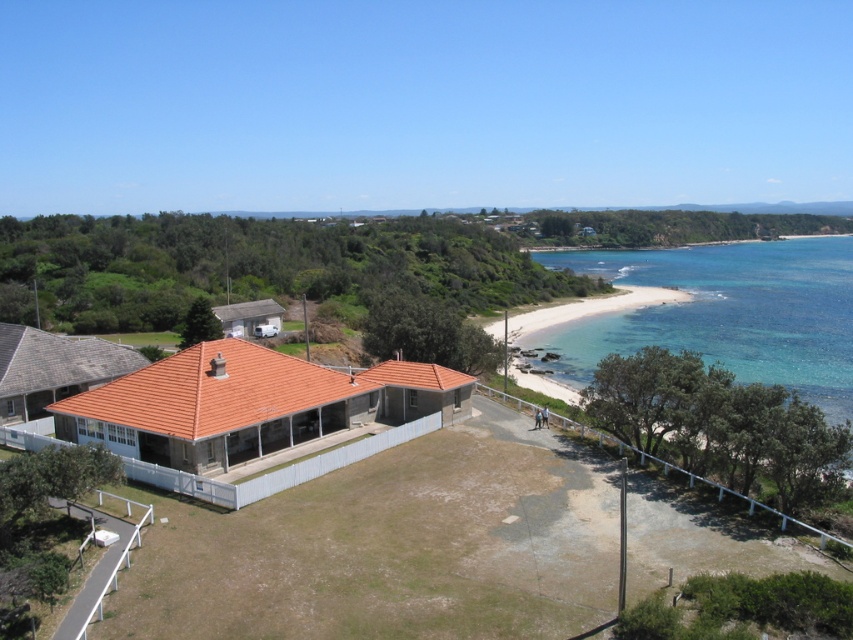
Question: Which point is closer to the camera taking this photo?

Choices:
 (A) (715, 301)
 (B) (3, 428)

Answer: (B)

Question: Which object is farther from the camera taking this photo?

Choices:
 (A) terracotta tiled house at center
 (B) clear blue water at beach right

Answer: (A)

Question: Can you confirm if terracotta tiled house at center is wider than clear blue water at beach right?

Choices:
 (A) yes
 (B) no

Answer: (B)

Question: Among these points, which one is nearest to the camera?

Choices:
 (A) (74, 417)
 (B) (573, 348)

Answer: (A)

Question: Can you confirm if terracotta tiled house at center is smaller than clear blue water at beach right?

Choices:
 (A) yes
 (B) no

Answer: (A)

Question: Can you confirm if terracotta tiled house at center is positioned below clear blue water at beach right?

Choices:
 (A) no
 (B) yes

Answer: (B)